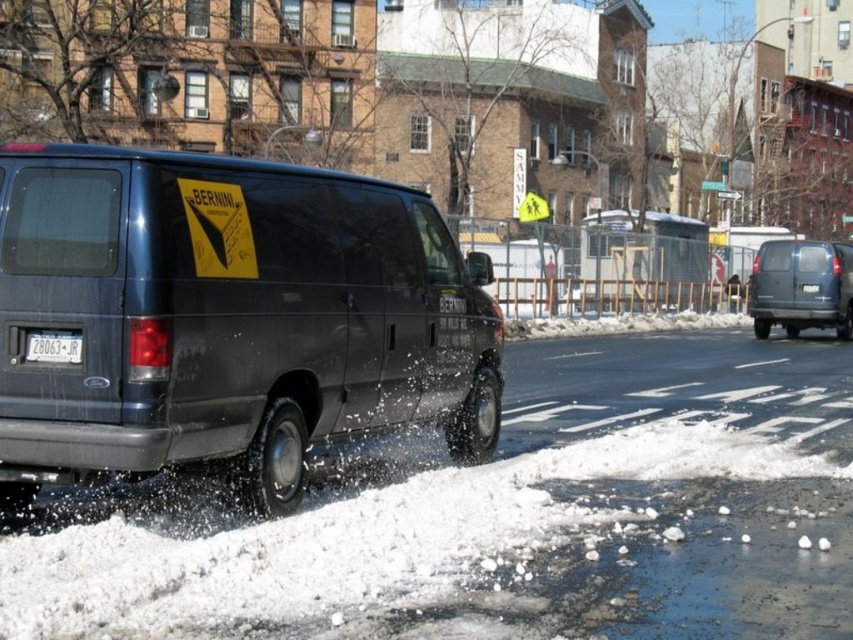
You are a delivery driver trying to park your matte black van at left and white plastic license plate at lower left in a tight space. Which object should you align to the right side when parking?

The matte black van at left is positioned on the right side of white plastic license plate at lower left, so you should align the matte black van at left to the right side when parking.

You are a delivery driver who needs to park your truck between the matte black van at left and the matte gray minivan at right. The parking space between them is 20 meters long. Can you fit your truck, which is 1.5 meters long, in the available space?

The distance between the matte black van at left and the matte gray minivan at right is 19.56 meters, which is slightly less than the required 20 meters. Therefore, the truck cannot fit in the available space.